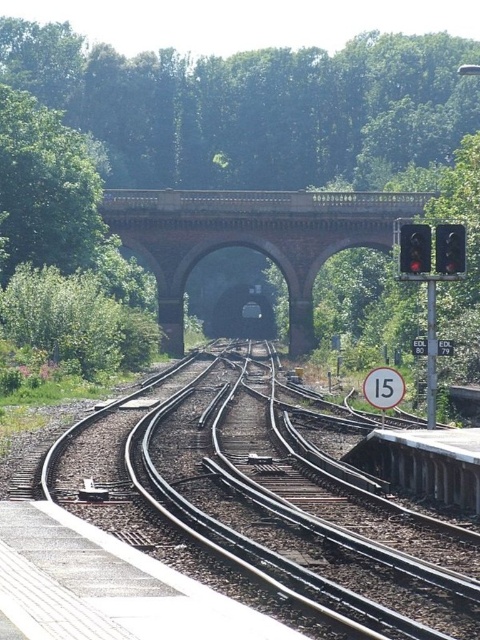
You are a railway engineer inspecting the area. You notice the green leafy trees at upper center and the brick stone bridge at center. Which object is positioned higher in the scene?

The green leafy trees at upper center are positioned higher in the scene than the brick stone bridge at center.